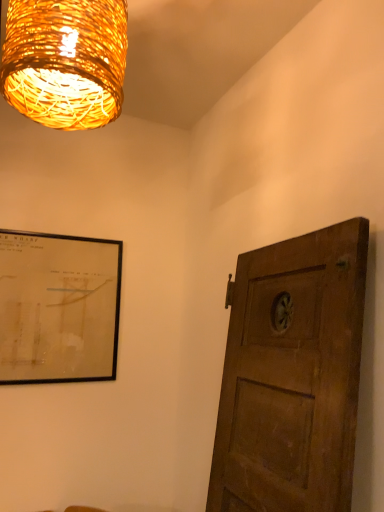
Where is `braided wicker lampshade at upper left`? braided wicker lampshade at upper left is located at coordinates (65, 61).

What is the approximate height of braided wicker lampshade at upper left?

The height of braided wicker lampshade at upper left is 19.43 inches.

This screenshot has height=512, width=384. What do you see at coordinates (65, 61) in the screenshot? I see `braided wicker lampshade at upper left` at bounding box center [65, 61].

The image size is (384, 512). I want to click on braided wicker lampshade at upper left, so click(x=65, y=61).